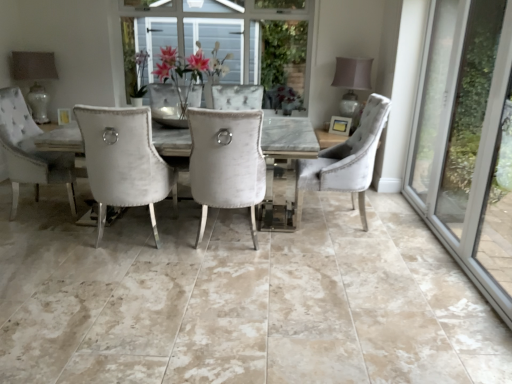
Identify the location of vacant space underneath velvet white chair at center, marked as the 2th chair in a right-to-left arrangement (from a real-world perspective). (224, 238).